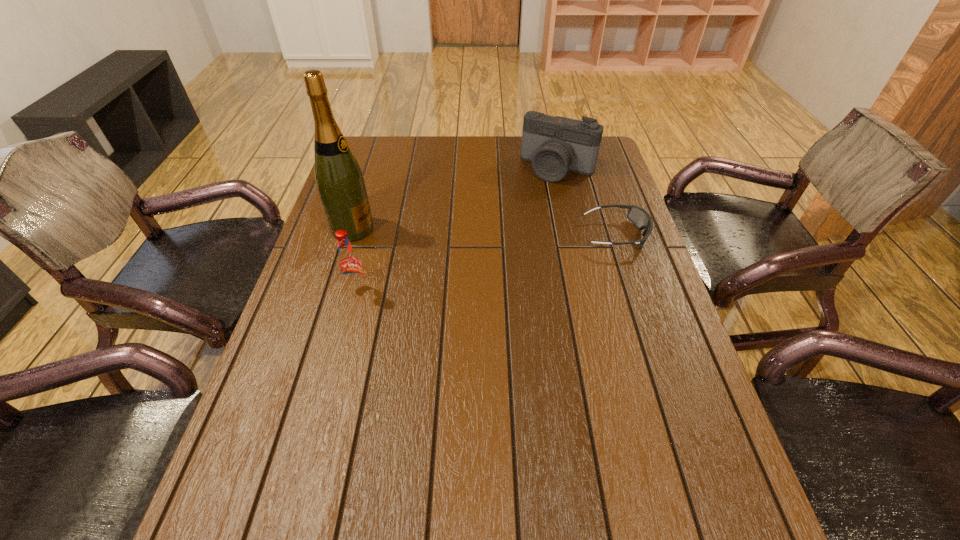
Identify the location of free space located on the front-facing side of the wine bottle. (492, 252).

The width and height of the screenshot is (960, 540). What are the coordinates of `object positioned at the far edge` in the screenshot? It's located at (555, 145).

I want to click on root beer present at the left edge, so click(x=350, y=267).

What are the coordinates of `wine bottle that is at the left edge` in the screenshot? It's located at (339, 179).

The height and width of the screenshot is (540, 960). I want to click on goggles located in the right edge section of the desktop, so click(x=638, y=216).

You are a GUI agent. You are given a task and a screenshot of the screen. Output one action in this format:
    pyautogui.click(x=<x>, y=<y>)
    Task: Click on the camera positioned at the right edge
    Image resolution: width=960 pixels, height=540 pixels.
    Given the screenshot: What is the action you would take?
    [x=555, y=145]

This screenshot has height=540, width=960. I want to click on object that is positioned at the far right corner, so click(x=555, y=145).

Find the location of `free space at the far edge`. free space at the far edge is located at coordinates (520, 165).

Locate an element on the screen. The image size is (960, 540). vacant space at the near edge of the desktop is located at coordinates tap(521, 462).

The width and height of the screenshot is (960, 540). Find the location of `vacant space at the left edge of the desktop`. vacant space at the left edge of the desktop is located at coordinates (324, 285).